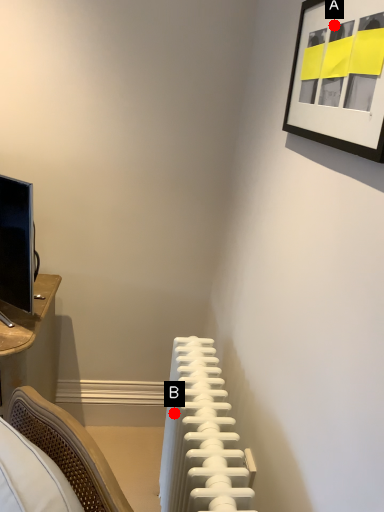
Question: Two points are circled on the image, labeled by A and B beside each circle. Which point is further to the camera?

Choices:
 (A) A is further
 (B) B is further

Answer: (B)